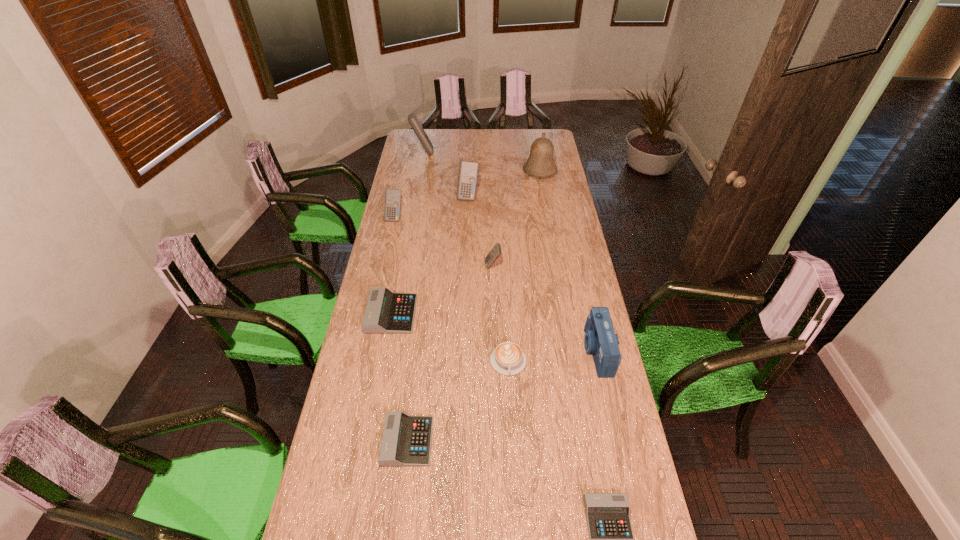
Where is `vacant region located 0.320m on the lens of the camera`? vacant region located 0.320m on the lens of the camera is located at coordinates (496, 351).

The image size is (960, 540). I want to click on free spot located 0.300m on the lens of the camera, so click(502, 351).

The width and height of the screenshot is (960, 540). What are the coordinates of `free space located on the front-facing side of the sixth calculator from left to right` in the screenshot? It's located at (457, 266).

Locate an element on the screen. Image resolution: width=960 pixels, height=540 pixels. vacant point located 0.260m on the front-facing side of the sixth calculator from left to right is located at coordinates (425, 266).

This screenshot has width=960, height=540. I want to click on free space located on the front-facing side of the sixth calculator from left to right, so click(x=445, y=266).

In order to click on vacant space located 0.360m on the front of the farthest gray calculator in this screenshot , I will do `click(372, 423)`.

Where is `vacant area situated 0.180m on the side of the cappuccino with the handle`? This screenshot has height=540, width=960. vacant area situated 0.180m on the side of the cappuccino with the handle is located at coordinates (512, 427).

This screenshot has height=540, width=960. Find the location of `vacant area situated 0.150m on the right of the sixth farthest calculator`. vacant area situated 0.150m on the right of the sixth farthest calculator is located at coordinates (480, 441).

I want to click on object that is at the far edge, so click(x=412, y=118).

The height and width of the screenshot is (540, 960). Identify the location of bell at the right edge. (540, 164).